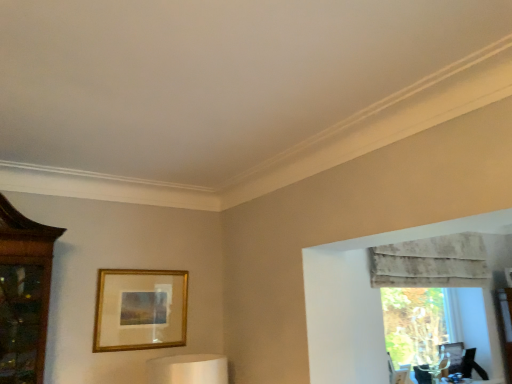
Question: Should I look upward or downward to see gold metallic picture frame at center?

Choices:
 (A) down
 (B) up

Answer: (A)

Question: Is textured beige curtain at upper right shorter than gold metallic picture frame at center?

Choices:
 (A) no
 (B) yes

Answer: (B)

Question: Are textured beige curtain at upper right and gold metallic picture frame at center making contact?

Choices:
 (A) no
 (B) yes

Answer: (A)

Question: From the image's perspective, is textured beige curtain at upper right located beneath gold metallic picture frame at center?

Choices:
 (A) yes
 (B) no

Answer: (B)

Question: Is there a large distance between textured beige curtain at upper right and gold metallic picture frame at center?

Choices:
 (A) no
 (B) yes

Answer: (B)

Question: Can you confirm if textured beige curtain at upper right is thinner than gold metallic picture frame at center?

Choices:
 (A) yes
 (B) no

Answer: (B)

Question: Can we say textured beige curtain at upper right lies outside gold metallic picture frame at center?

Choices:
 (A) no
 (B) yes

Answer: (B)

Question: Does transparent glass vase at right have a greater height compared to gold metallic picture frame at center?

Choices:
 (A) yes
 (B) no

Answer: (A)

Question: Considering the relative sizes of transparent glass vase at right and gold metallic picture frame at center in the image provided, is transparent glass vase at right bigger than gold metallic picture frame at center?

Choices:
 (A) no
 (B) yes

Answer: (B)

Question: Does transparent glass vase at right appear on the right side of gold metallic picture frame at center?

Choices:
 (A) yes
 (B) no

Answer: (A)

Question: Can you confirm if transparent glass vase at right is thinner than gold metallic picture frame at center?

Choices:
 (A) yes
 (B) no

Answer: (B)

Question: Considering the relative positions of transparent glass vase at right and gold metallic picture frame at center in the image provided, is transparent glass vase at right to the left of gold metallic picture frame at center from the viewer's perspective?

Choices:
 (A) no
 (B) yes

Answer: (A)

Question: Does transparent glass vase at right have a greater width compared to gold metallic picture frame at center?

Choices:
 (A) no
 (B) yes

Answer: (B)

Question: Is textured beige curtain at upper right located within gold metallic picture frame at center?

Choices:
 (A) no
 (B) yes

Answer: (A)